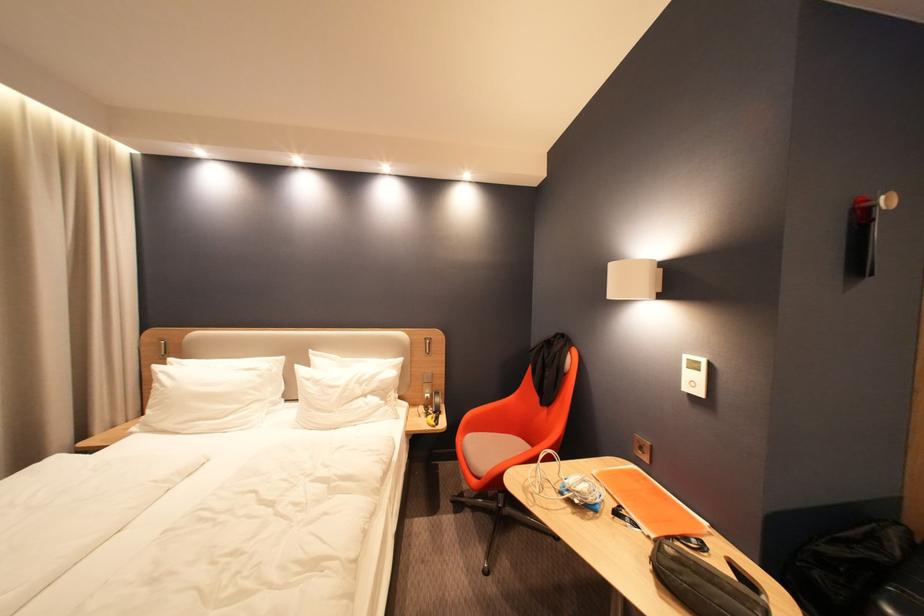
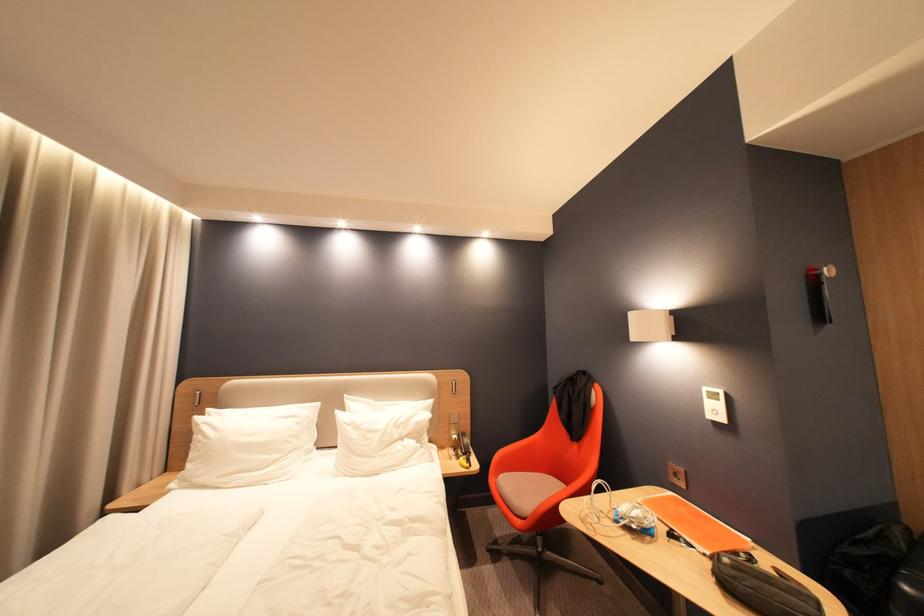
Find the pixel in the second image that matches pixel 535 492 in the first image.

(592, 523)